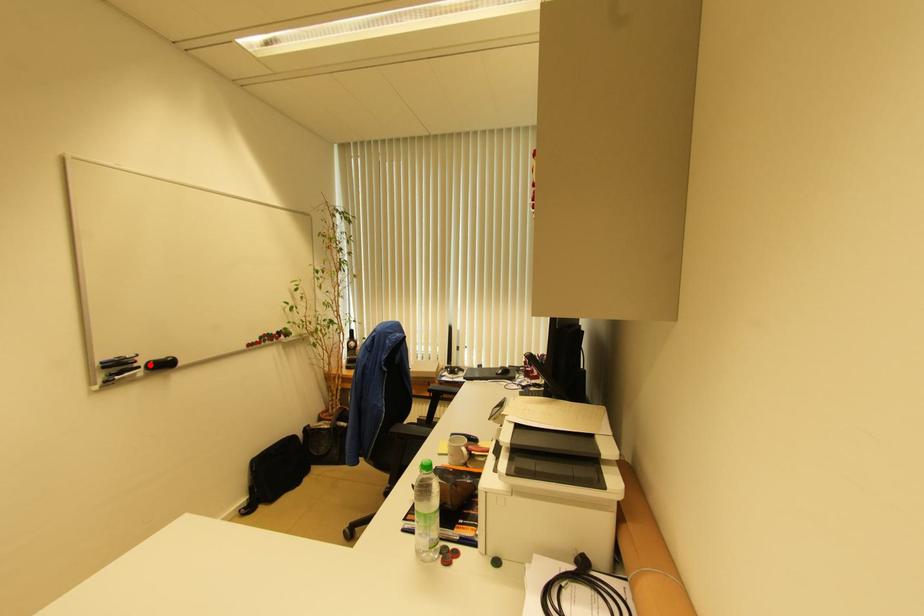
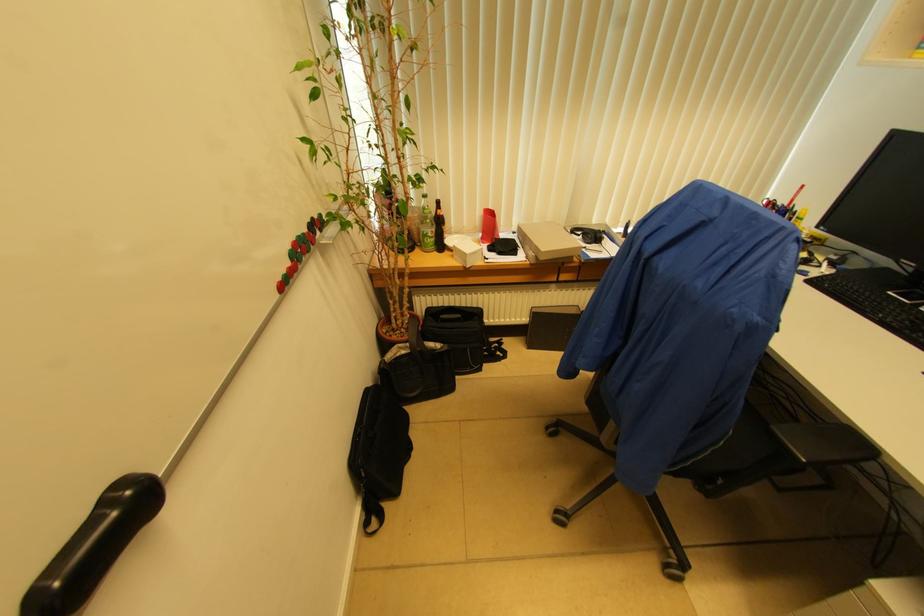
Where in the second image is the point corresponding to the highlighted location from the first image?

(35, 600)